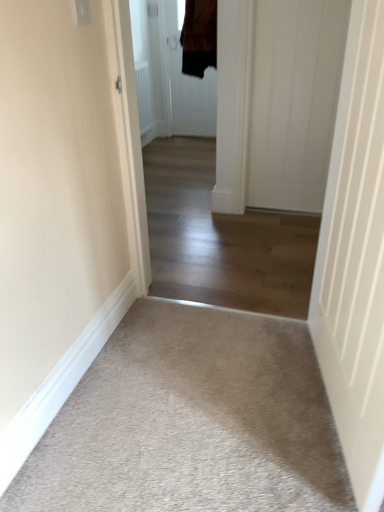
Question: Is brown suede jacket at upper center at the right side of white smooth door at right, which is the 3th door in top-to-bottom order?

Choices:
 (A) no
 (B) yes

Answer: (A)

Question: Is brown suede jacket at upper center thinner than white smooth door at right, the third door positioned from the back?

Choices:
 (A) yes
 (B) no

Answer: (B)

Question: Does brown suede jacket at upper center have a larger size compared to white smooth door at right, the first door from the bottom?

Choices:
 (A) no
 (B) yes

Answer: (B)

Question: From the image's perspective, is brown suede jacket at upper center located above white smooth door at right, positioned as the second door in right-to-left order?

Choices:
 (A) yes
 (B) no

Answer: (A)

Question: Is brown suede jacket at upper center positioned far away from white smooth door at right, which is the 3th door in top-to-bottom order?

Choices:
 (A) no
 (B) yes

Answer: (B)

Question: Can you confirm if brown suede jacket at upper center is positioned to the left of white smooth door at right, the 1th door from the front?

Choices:
 (A) yes
 (B) no

Answer: (A)

Question: Can you confirm if light beige carpet at center is taller than white smooth door at right, which is the 3th door in top-to-bottom order?

Choices:
 (A) yes
 (B) no

Answer: (B)

Question: Is light beige carpet at center further to camera compared to white smooth door at right, the first door from the bottom?

Choices:
 (A) no
 (B) yes

Answer: (B)

Question: Is light beige carpet at center to the left of white smooth door at right, the third door positioned from the back, from the viewer's perspective?

Choices:
 (A) no
 (B) yes

Answer: (B)

Question: Considering the relative positions of light beige carpet at center and white smooth door at right, positioned as the second door in right-to-left order, in the image provided, is light beige carpet at center to the right of white smooth door at right, positioned as the second door in right-to-left order, from the viewer's perspective?

Choices:
 (A) yes
 (B) no

Answer: (B)

Question: Is light beige carpet at center turned away from white smooth door at right, the 1th door from the front?

Choices:
 (A) no
 (B) yes

Answer: (A)

Question: From the image's perspective, is light beige carpet at center on white smooth door at right, the third door positioned from the back?

Choices:
 (A) yes
 (B) no

Answer: (A)

Question: Does beige carpet at lower left have a lesser width compared to brown fabric door at center, the first door positioned from the back?

Choices:
 (A) yes
 (B) no

Answer: (B)